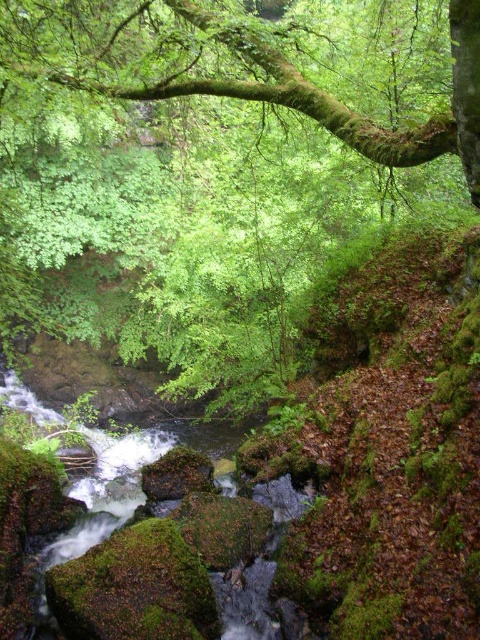
You are a nature photographer aiming to capture the green mossy branch at upper center and the green mossy water at center in one frame. Which object should you focus on first if you want to ensure both are in focus?

The green mossy branch at upper center is smaller than the green mossy water at center, so focusing on the larger green mossy water at center first would help ensure both are in focus.

You are an explorer in the forest and want to locate the green mossy branch at upper center. According to the coordinates provided, where should you look in the image?

The green mossy branch at upper center is located at point coordinates of (x=344, y=104).